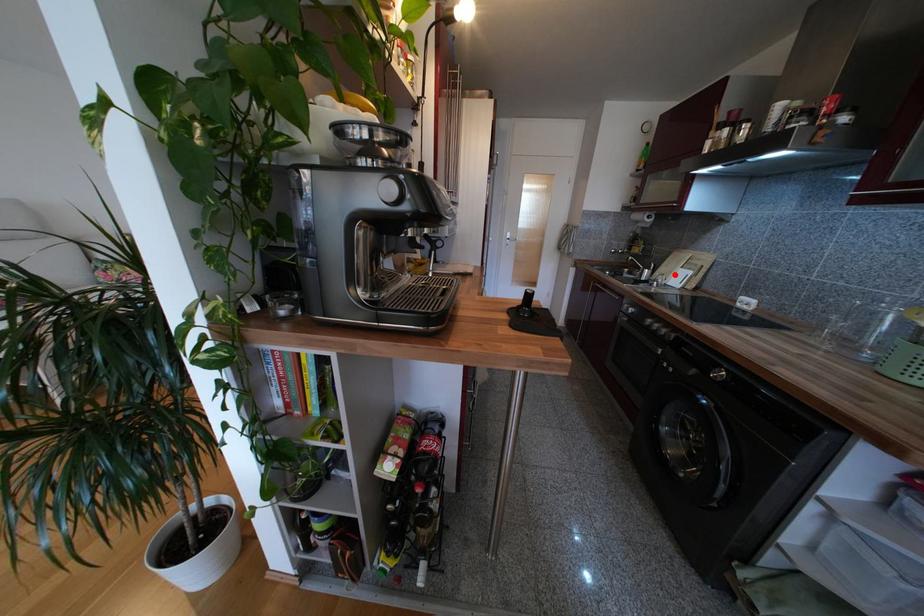
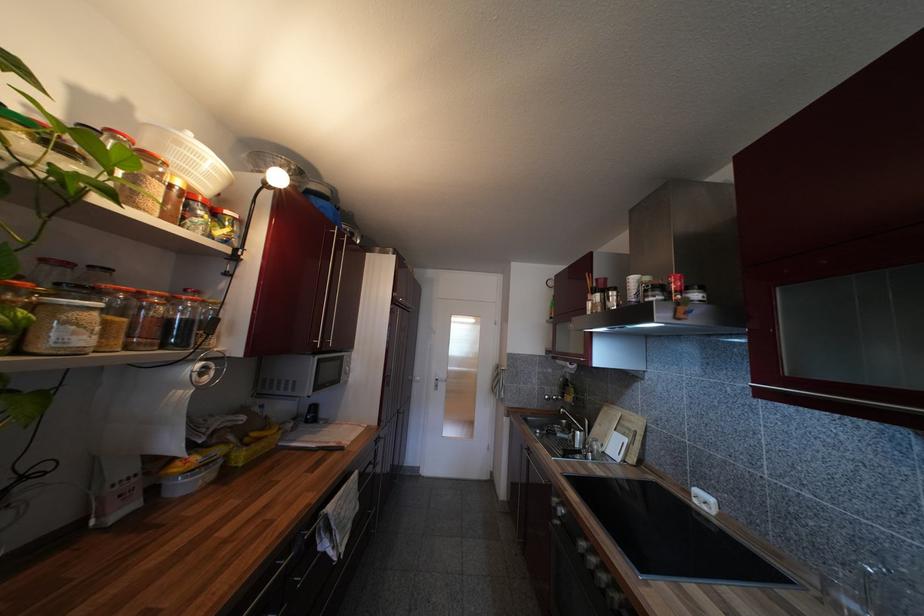
Question: I am providing you with two images of the same scene from different viewpoints. Given a red point in image1, look at the same physical point in image2. Is it:

Choices:
 (A) Closer to the viewpoint
 (B) Farther from the viewpoint

Answer: (B)